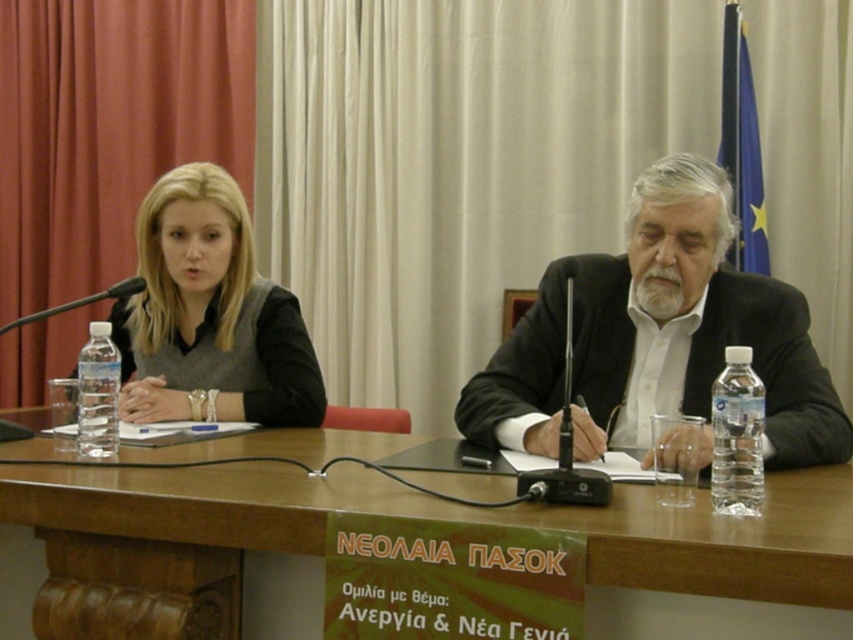
Can you confirm if white matte suit at center is positioned to the right of clear plastic bottle at left?

Yes, white matte suit at center is to the right of clear plastic bottle at left.

The image size is (853, 640). In order to click on white matte suit at center in this screenshot , I will do `click(657, 337)`.

Which is in front, point (546, 413) or point (79, 445)?

Point (79, 445) is in front.

Find the location of `white matte suit at center`. white matte suit at center is located at coordinates (657, 337).

What do you see at coordinates (432, 516) in the screenshot? This screenshot has height=640, width=853. I see `brown wooden table at center` at bounding box center [432, 516].

The width and height of the screenshot is (853, 640). Describe the element at coordinates (432, 516) in the screenshot. I see `brown wooden table at center` at that location.

Where is `brown wooden table at center`? brown wooden table at center is located at coordinates tap(432, 516).

Can you confirm if clear plastic bottle at right is thinner than clear plastic bottle at left?

In fact, clear plastic bottle at right might be wider than clear plastic bottle at left.

Is point (746, 444) positioned before point (115, 440)?

Yes, it is in front of point (115, 440).

Is point (752, 448) positioned behind point (94, 445)?

No.

Identify the location of clear plastic bottle at right. This screenshot has width=853, height=640. (737, 436).